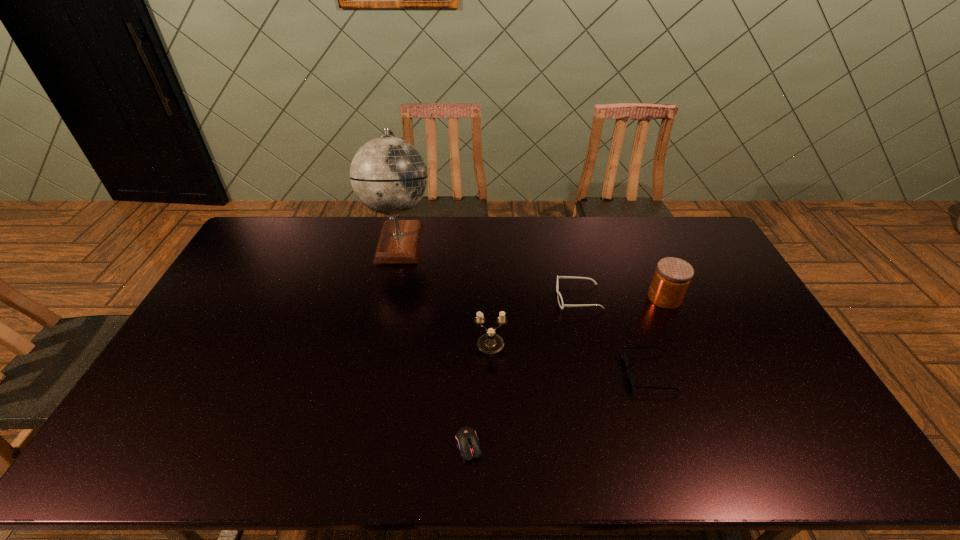
Locate an element on the screen. The image size is (960, 540). globe is located at coordinates (388, 175).

Where is `the tallest object`? the tallest object is located at coordinates (388, 175).

Where is `the rightmost object`? This screenshot has width=960, height=540. the rightmost object is located at coordinates (672, 277).

Image resolution: width=960 pixels, height=540 pixels. What are the coordinates of `candle holder` in the screenshot? It's located at (490, 343).

At what (x,y) coordinates should I click in order to perform the action: click on the fourth tallest object. Please return your answer as a coordinate pair (x, y). The height and width of the screenshot is (540, 960). Looking at the image, I should click on (560, 300).

At what (x,y) coordinates should I click in order to perform the action: click on the taller sunglasses. Please return your answer as a coordinate pair (x, y). Looking at the image, I should click on (560, 300).

Identify the location of the fifth object from left to right. (632, 377).

The image size is (960, 540). I want to click on the right sunglasses, so click(632, 377).

Locate an element on the screen. the nearest object is located at coordinates (467, 441).

Find the location of `vacant area situated at the equator of the globe`. vacant area situated at the equator of the globe is located at coordinates (504, 241).